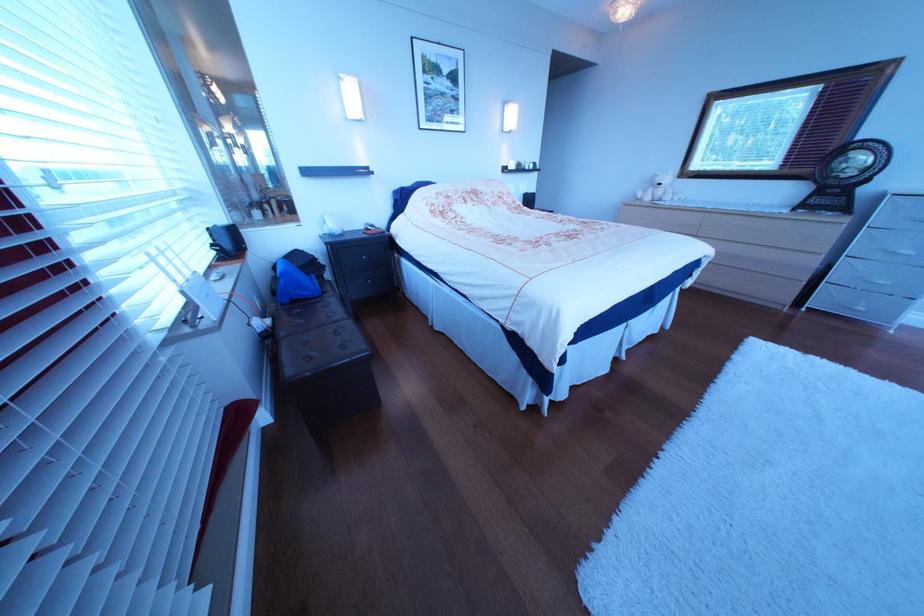
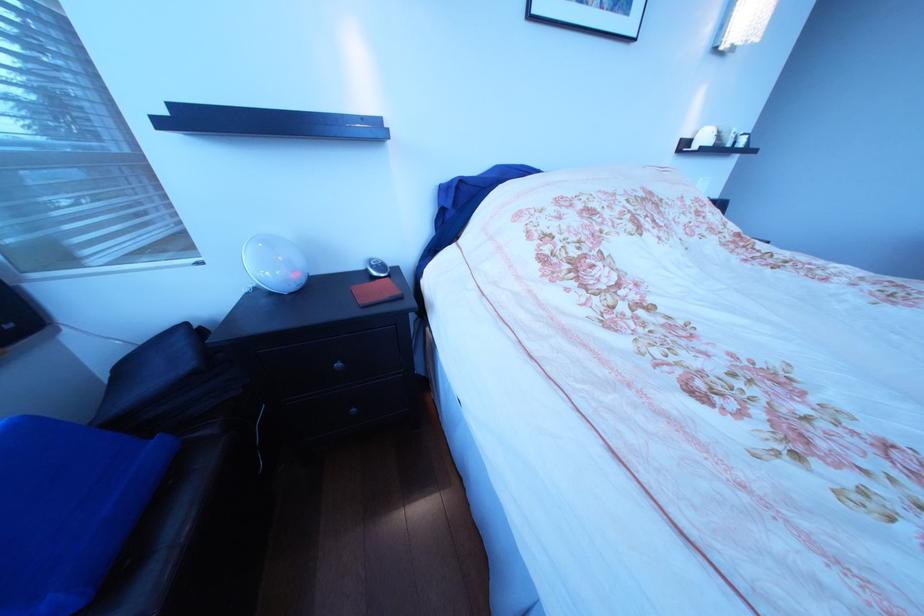
In the second image, find the point that corresponds to the point at 339,237 in the first image.

(272, 291)